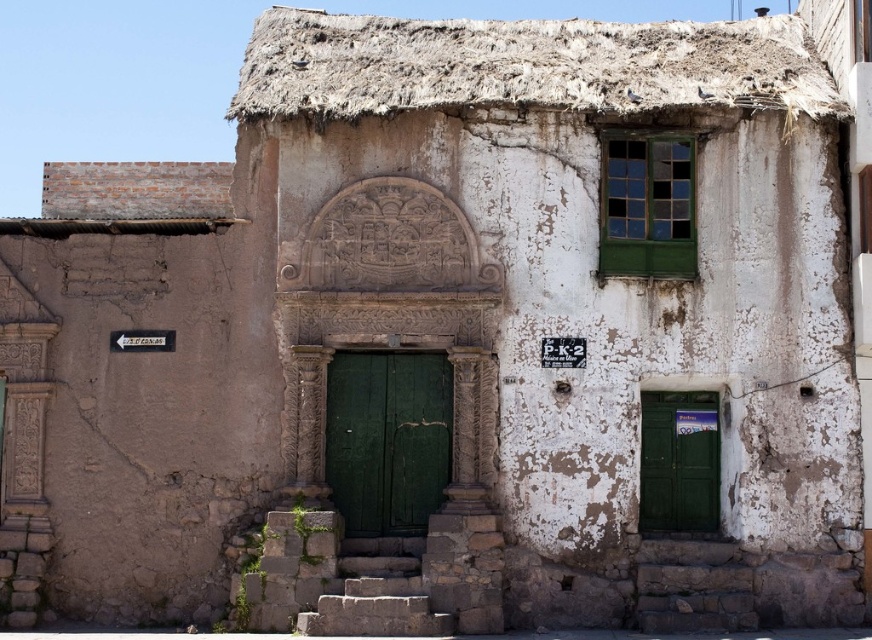
Is point (330, 449) less distant than point (666, 404)?

Yes, it is in front of point (666, 404).

Does green wooden door at center appear over green matte door at lower right?

Yes, green wooden door at center is above green matte door at lower right.

Is point (385, 468) farther from viewer compared to point (692, 413)?

No, (385, 468) is in front of (692, 413).

The image size is (872, 640). In order to click on green wooden door at center in this screenshot , I will do `click(387, 440)`.